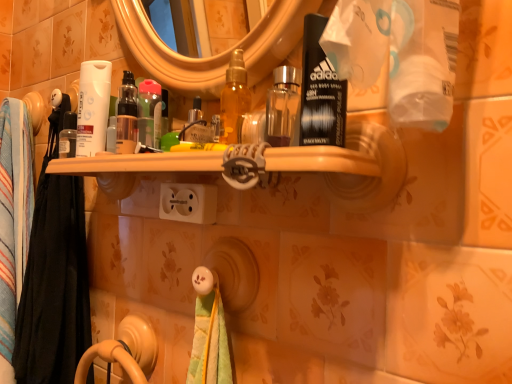
Question: From the image's perspective, is multicolored fabric towel at left, which ranks as the 2th bath towel in back-to-front order, positioned above or below translucent plastic bottle at center?

Choices:
 (A) below
 (B) above

Answer: (A)

Question: Do you think multicolored fabric towel at left, the first bath towel when ordered from front to back, is within translucent plastic bottle at center, or outside of it?

Choices:
 (A) outside
 (B) inside

Answer: (A)

Question: Estimate the real-world distances between objects in this image. Which object is farther from the white plastic outlet at center?

Choices:
 (A) translucent plastic bottle at center
 (B) multicolored fabric towel at left, which ranks as the 2th bath towel in back-to-front order
 (C) black fabric towel at left, which is counted as the second bath towel, starting from the front
 (D) white matte tube at left

Answer: (C)

Question: Considering the real-world distances, which object is farthest from the white matte tube at left?

Choices:
 (A) black fabric towel at left, which is counted as the second bath towel, starting from the front
 (B) translucent plastic bottle at center
 (C) white plastic outlet at center
 (D) multicolored fabric towel at left, which ranks as the 2th bath towel in back-to-front order

Answer: (A)